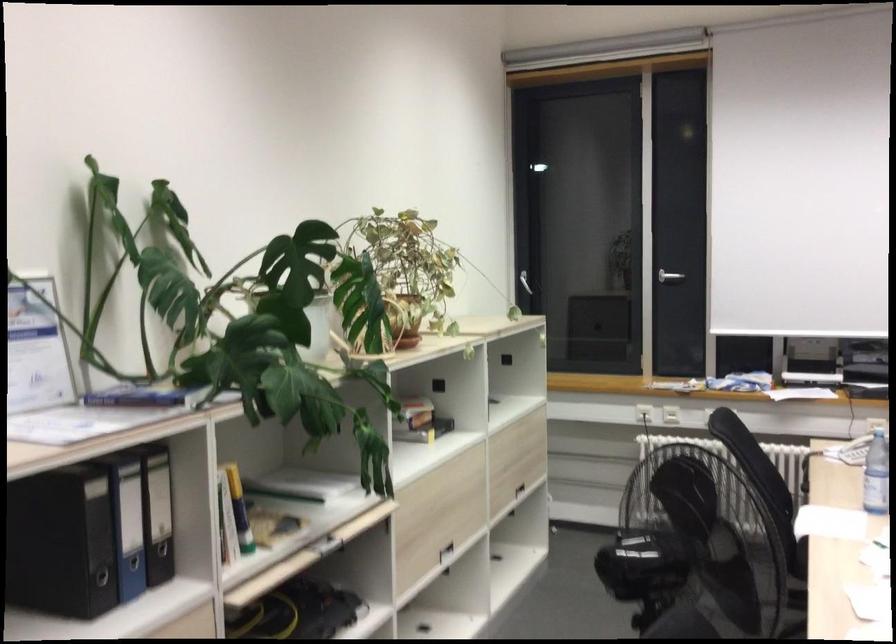
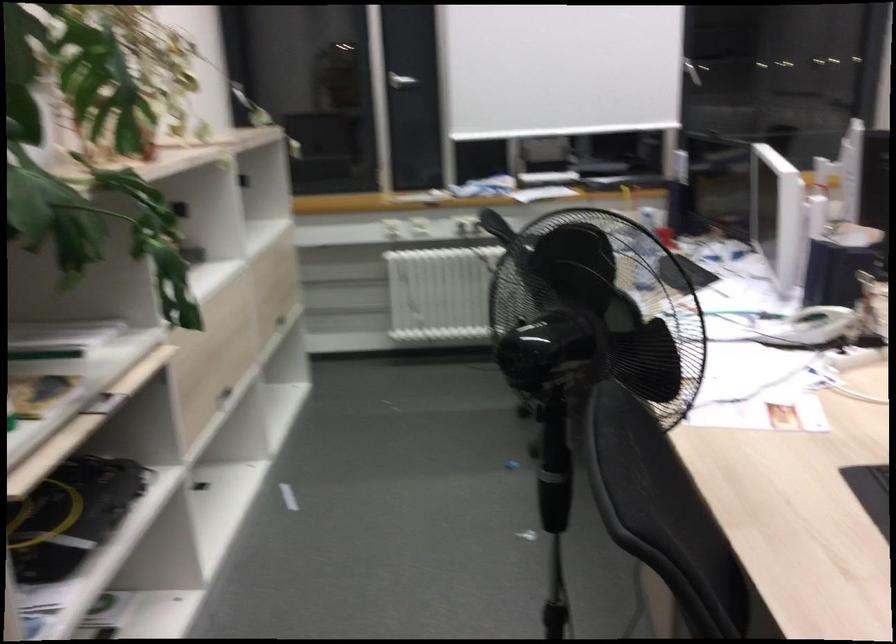
In the second image, find the point that corresponds to (x=426, y=547) in the first image.

(211, 395)